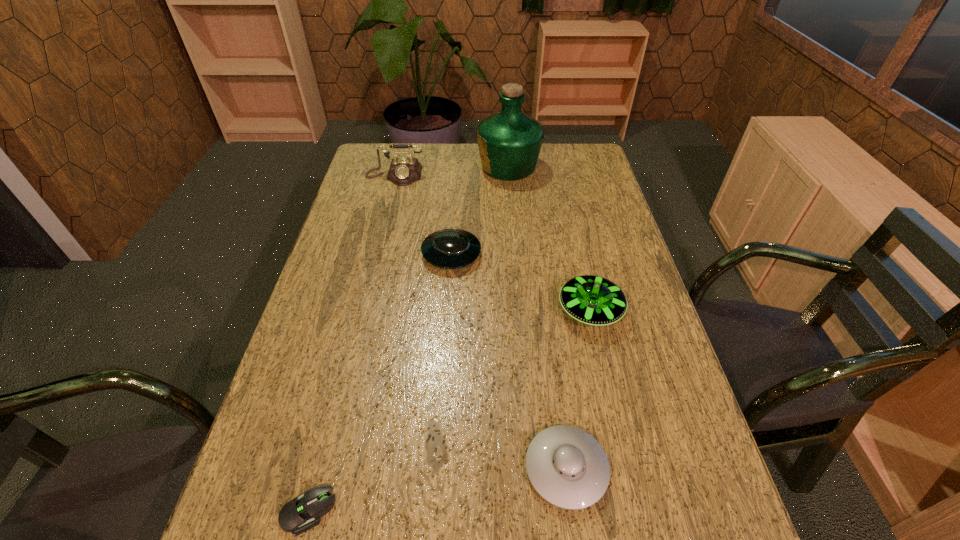
Locate an element on the screen. The width and height of the screenshot is (960, 540). vacant space in between the fifth shortest object and the nearest saucer is located at coordinates (481, 322).

Locate an element on the screen. The width and height of the screenshot is (960, 540). vacant area between the third tallest object and the leftmost saucer is located at coordinates (521, 282).

Find the location of a particular element. The width and height of the screenshot is (960, 540). free space between the nearest saucer and the farthest saucer is located at coordinates (509, 361).

Find the location of a particular element. free space between the nearest saucer and the second nearest saucer is located at coordinates (578, 389).

Locate an element on the screen. The height and width of the screenshot is (540, 960). free space between the liquor and the nearest saucer is located at coordinates (538, 318).

Where is `vacant space that's between the nearest saucer and the tallest object`? vacant space that's between the nearest saucer and the tallest object is located at coordinates (538, 318).

Find the location of `object identified as the third closest to the telephone`. object identified as the third closest to the telephone is located at coordinates (593, 300).

This screenshot has height=540, width=960. In order to click on object that is the nearest to the fourth shortest object in this screenshot , I will do `click(449, 248)`.

Where is `the second closest saucer relative to the second nearest saucer`? the second closest saucer relative to the second nearest saucer is located at coordinates (567, 467).

Identify the location of saucer that can be found as the second closest to the fourth farthest object. (567, 467).